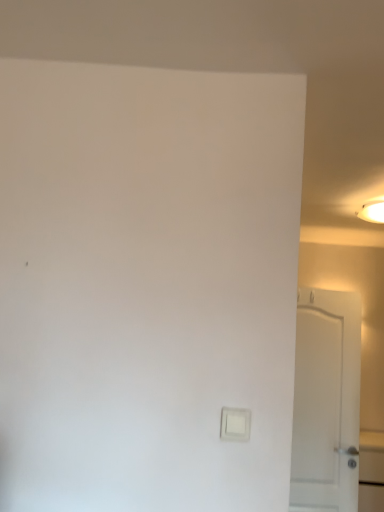
Where is `white plastic light switch at lower center`? Image resolution: width=384 pixels, height=512 pixels. white plastic light switch at lower center is located at coordinates (235, 424).

Where is `white glossy light fixture at upper right`? white glossy light fixture at upper right is located at coordinates (372, 211).

From a real-world perspective, is white glossy light fixture at upper right physically located above or below white plastic light switch at lower center?

From a real-world perspective, white glossy light fixture at upper right is physically above white plastic light switch at lower center.

Does point (369, 207) lie behind point (227, 435)?

Yes, point (369, 207) is behind point (227, 435).

Is white glossy light fixture at upper right not inside white plastic light switch at lower center?

white glossy light fixture at upper right is positioned outside white plastic light switch at lower center.

From the image's perspective, which object appears higher, white matte door at right or white plastic light switch at lower center?

white plastic light switch at lower center is shown above in the image.

Is white matte door at right taller or shorter than white plastic light switch at lower center?

In the image, white matte door at right appears to be taller than white plastic light switch at lower center.

Which point is more forward, (360,320) or (223,435)?

Positioned in front is point (223,435).

In terms of size, does white matte door at right appear bigger or smaller than white plastic light switch at lower center?

white matte door at right is bigger than white plastic light switch at lower center.

Are white plastic light switch at lower center and white matte door at right making contact?

There is a gap between white plastic light switch at lower center and white matte door at right.

From the picture: Considering the relative positions of white plastic light switch at lower center and white matte door at right in the image provided, is white plastic light switch at lower center to the left or to the right of white matte door at right?

Based on their positions, white plastic light switch at lower center is located to the left of white matte door at right.

Is white plastic light switch at lower center facing towards white matte door at right?

No, white plastic light switch at lower center is not oriented towards white matte door at right.

Does point (248, 411) lie in front of point (356, 385)?

Yes, point (248, 411) is in front of point (356, 385).

From the image's perspective, which object appears higher, white glossy light fixture at upper right or white matte door at right?

From the image's view, white glossy light fixture at upper right is above.

From a real-world perspective, is white glossy light fixture at upper right below white matte door at right?

Incorrect, from a real-world perspective, white glossy light fixture at upper right is higher than white matte door at right.

Is white glossy light fixture at upper right facing away from white matte door at right?

white glossy light fixture at upper right does not have its back to white matte door at right.

In the image, is white glossy light fixture at upper right on the left side or the right side of white matte door at right?

From the image, it's evident that white glossy light fixture at upper right is to the right of white matte door at right.

How many degrees apart are the facing directions of white matte door at right and white glossy light fixture at upper right?

5.66 degrees separate the facing orientations of white matte door at right and white glossy light fixture at upper right.

Consider the image. Is white matte door at right far from white glossy light fixture at upper right?

That's right, there is a large distance between white matte door at right and white glossy light fixture at upper right.

From the image's perspective, is white matte door at right on top of white glossy light fixture at upper right?

No, from the image's perspective, white matte door at right is not over white glossy light fixture at upper right.

Who is smaller, white matte door at right or white glossy light fixture at upper right?

white glossy light fixture at upper right.

From the image's perspective, would you say white plastic light switch at lower center is positioned over white glossy light fixture at upper right?

Incorrect, from the image's perspective, white plastic light switch at lower center is lower than white glossy light fixture at upper right.

Which object is positioned more to the left, white plastic light switch at lower center or white glossy light fixture at upper right?

white plastic light switch at lower center.

Consider the image. How many degrees apart are the facing directions of white plastic light switch at lower center and white glossy light fixture at upper right?

The angle between the facing direction of white plastic light switch at lower center and the facing direction of white glossy light fixture at upper right is 1.84 degrees.

From a real-world perspective, is white plastic light switch at lower center physically located above or below white glossy light fixture at upper right?

white plastic light switch at lower center is below white glossy light fixture at upper right.

At what (x,y) coordinates should I click in order to perform the action: click on light switch that is below the white glossy light fixture at upper right (from the image's perspective). Please return your answer as a coordinate pair (x, y). Looking at the image, I should click on (235, 424).

Image resolution: width=384 pixels, height=512 pixels. In order to click on light switch located above the white matte door at right (from the image's perspective) in this screenshot , I will do `click(235, 424)`.

Looking at the image, which one is located closer to white glossy light fixture at upper right, white plastic light switch at lower center or white matte door at right?

white matte door at right lies closer to white glossy light fixture at upper right than the other object.

When comparing their distances from white plastic light switch at lower center, does white matte door at right or white glossy light fixture at upper right seem further?

white glossy light fixture at upper right is further to white plastic light switch at lower center.

From the image, which object appears to be nearer to white matte door at right, white glossy light fixture at upper right or white plastic light switch at lower center?

white glossy light fixture at upper right lies closer to white matte door at right than the other object.

Which object lies further to the anchor point white glossy light fixture at upper right, white matte door at right or white plastic light switch at lower center?

The object further to white glossy light fixture at upper right is white plastic light switch at lower center.

When comparing their distances from white matte door at right, does white plastic light switch at lower center or white glossy light fixture at upper right seem further?

The object further to white matte door at right is white plastic light switch at lower center.

Consider the image. When comparing their distances from white plastic light switch at lower center, does white glossy light fixture at upper right or white matte door at right seem further?

white glossy light fixture at upper right is further to white plastic light switch at lower center.

This screenshot has height=512, width=384. I want to click on door between white plastic light switch at lower center and white glossy light fixture at upper right in the front-back direction, so click(326, 401).